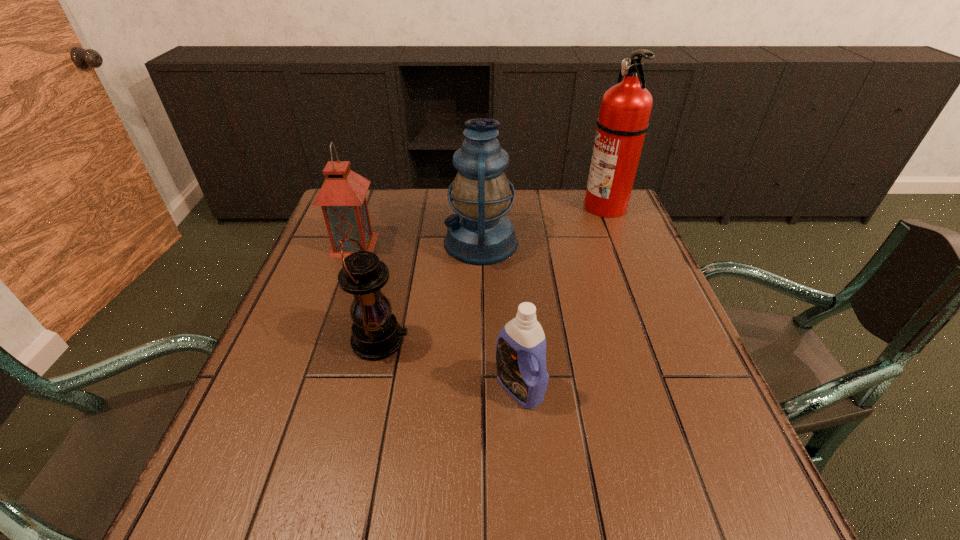
Find the location of `free location located 0.190m at the nozzle of the rightmost object`. free location located 0.190m at the nozzle of the rightmost object is located at coordinates (520, 206).

Image resolution: width=960 pixels, height=540 pixels. I want to click on blank space located 0.140m on the face of the rightmost lantern, so [392, 242].

Where is `vacant space located on the face of the rightmost lantern`? This screenshot has width=960, height=540. vacant space located on the face of the rightmost lantern is located at coordinates (411, 242).

At what (x,y) coordinates should I click in order to perform the action: click on vacant space located 0.140m on the face of the rightmost lantern. Please return your answer as a coordinate pair (x, y). This screenshot has height=540, width=960. Looking at the image, I should click on (392, 242).

Find the location of a particular element. vacant space located on the right of the leftmost object is located at coordinates (476, 245).

Locate several points within the vacant space situated above the fourth object from right to left, indicating its light source. Please provide its 2D coordinates. Your answer should be formatted as a tuple, i.e. [(x, y)], where the tuple contains the x and y coordinates of a point satisfying the conditions above.

[(437, 341)]

Where is `free space located 0.110m on the back of the detergent`? This screenshot has height=540, width=960. free space located 0.110m on the back of the detergent is located at coordinates (515, 326).

Locate an element on the screen. This screenshot has height=540, width=960. fire extinguisher present at the far edge is located at coordinates (625, 110).

Locate an element on the screen. object that is at the left edge is located at coordinates 342,197.

Locate an element on the screen. This screenshot has height=540, width=960. object situated at the right edge is located at coordinates (625, 110).